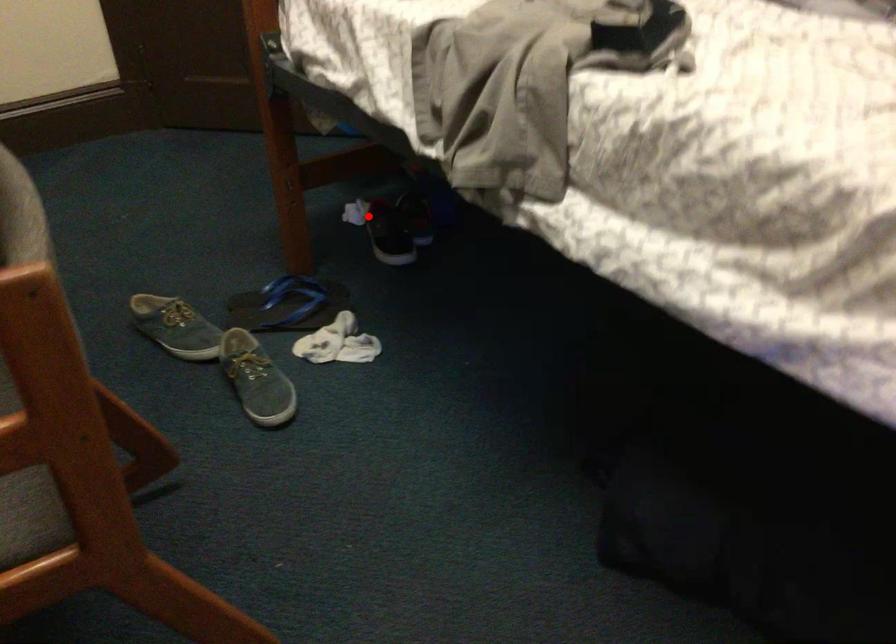
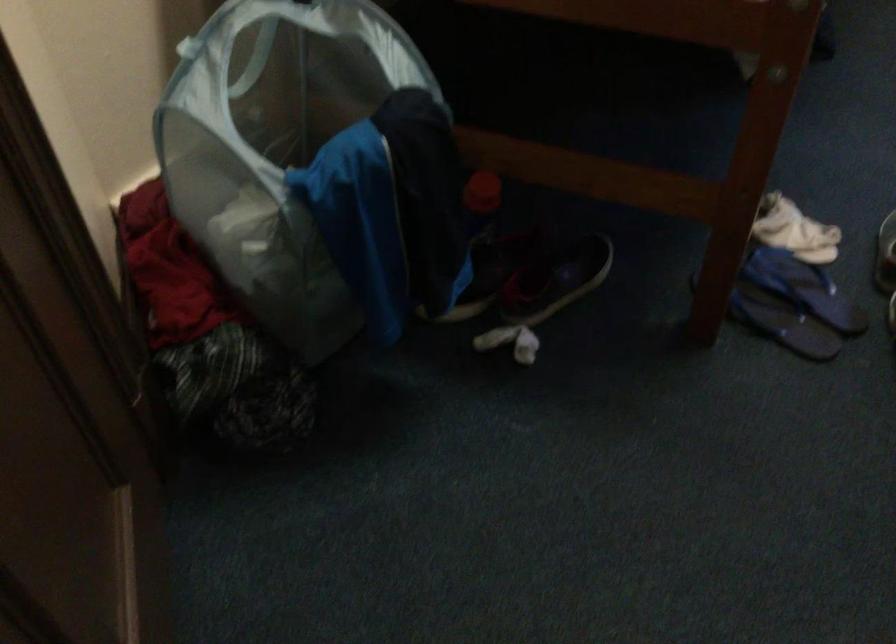
Find the pixel in the second image that matches the highlighted location in the first image.

(556, 279)